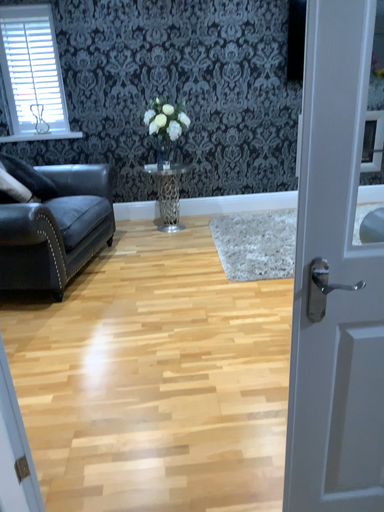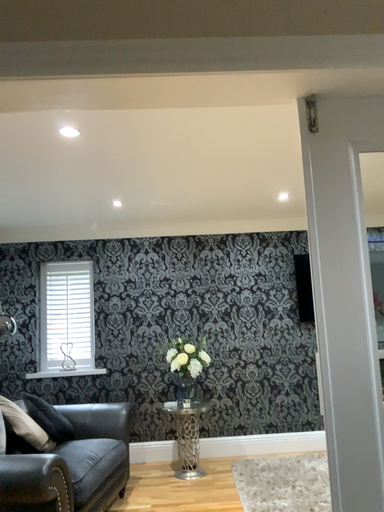
Question: How did the camera likely rotate when shooting the video?

Choices:
 (A) rotated upward
 (B) rotated downward

Answer: (A)